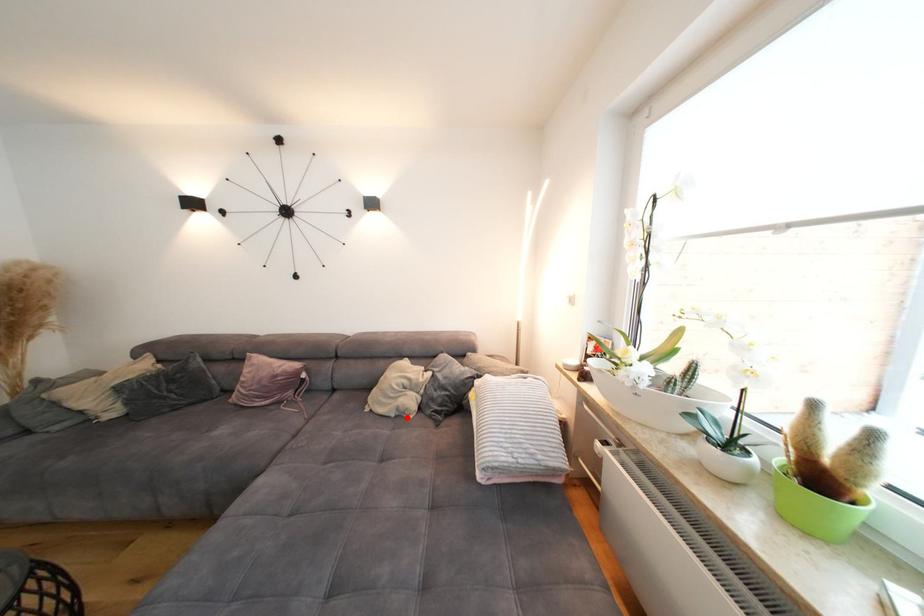
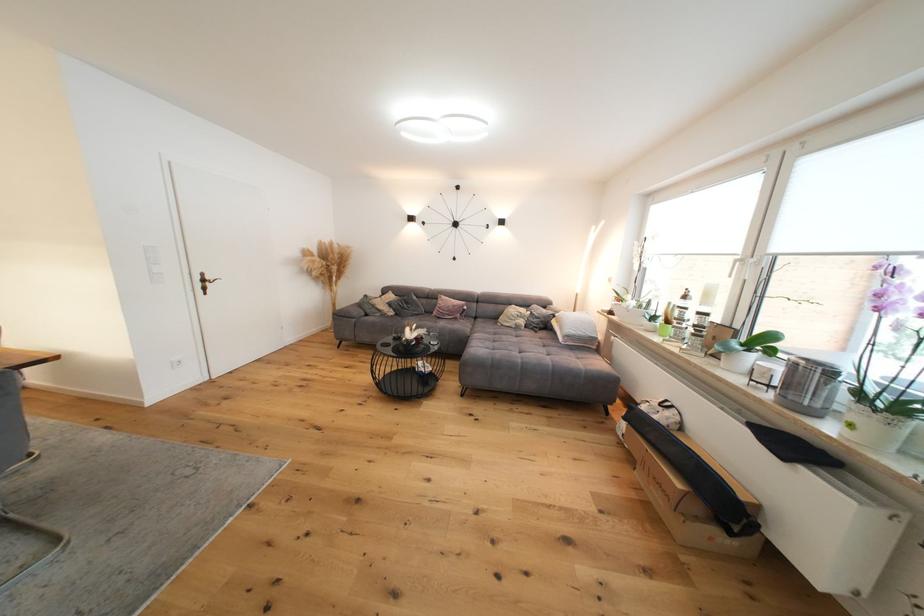
Find the pixel in the second image that matches the highlighted location in the first image.

(524, 330)